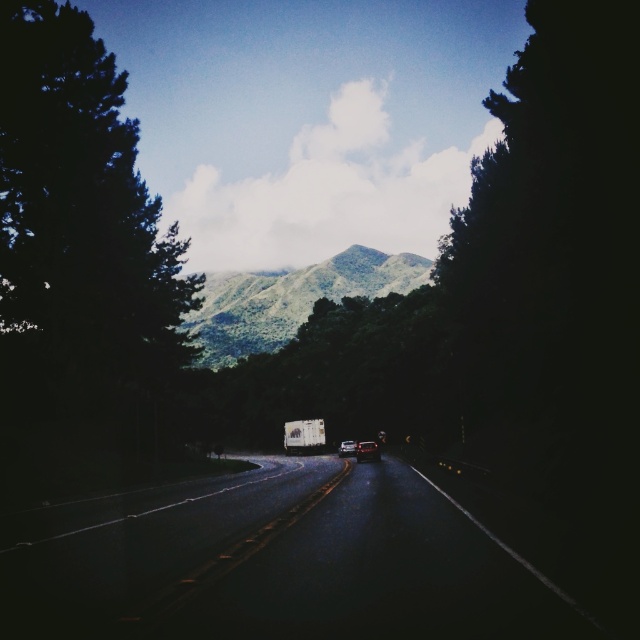
Is point (161, 276) positioned behind point (349, 451)?

That is False.

Between point (54, 60) and point (342, 448), which one is positioned behind?

The point (342, 448) is more distant.

Find the location of `green leafy tree at left`. green leafy tree at left is located at coordinates (77, 227).

Is green leafy tree at left smaller than green leafy mountain at center?

Correct, green leafy tree at left occupies less space than green leafy mountain at center.

Does point (164, 291) lie behind point (200, 336)?

No, (164, 291) is in front of (200, 336).

The image size is (640, 640). In order to click on green leafy tree at left in this screenshot , I will do `click(77, 227)`.

The width and height of the screenshot is (640, 640). In order to click on green leafy mountain at center in this screenshot , I will do `click(291, 300)`.

Does point (348, 294) come closer to viewer compared to point (314, 426)?

No, (348, 294) is behind (314, 426).

Find the location of `green leafy mountain at center`. green leafy mountain at center is located at coordinates (291, 300).